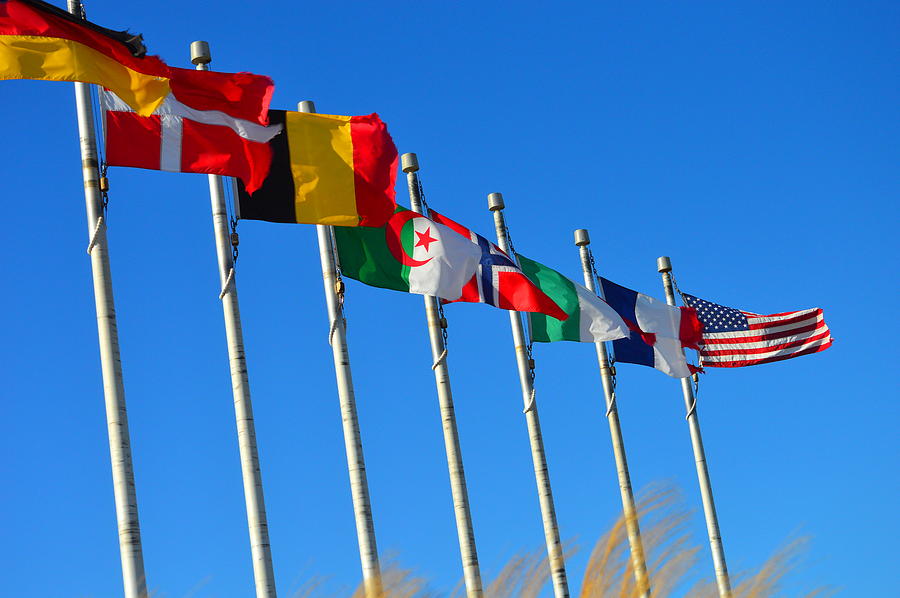
Find the location of `finial`. finial is located at coordinates (662, 263), (580, 236), (495, 202), (412, 161), (308, 106), (202, 50).